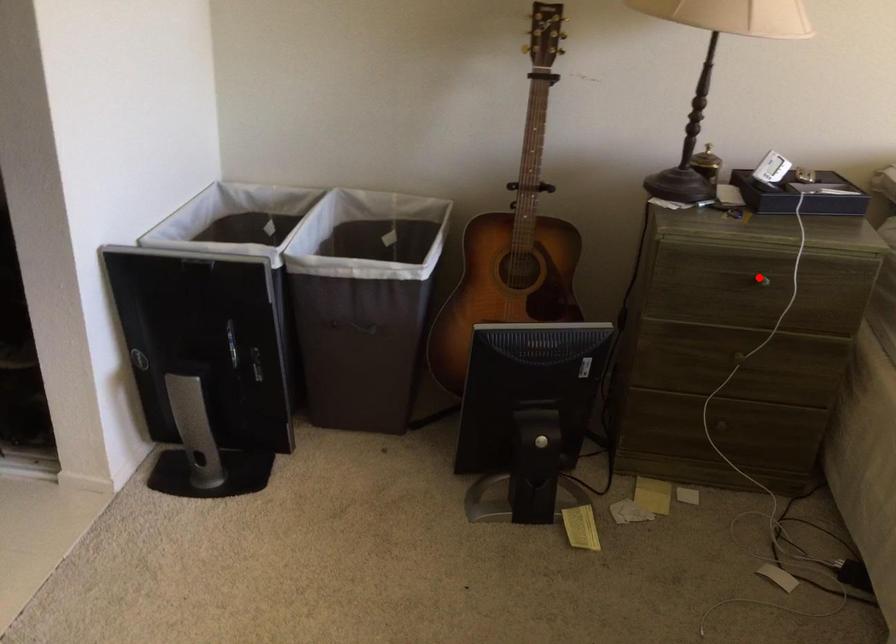
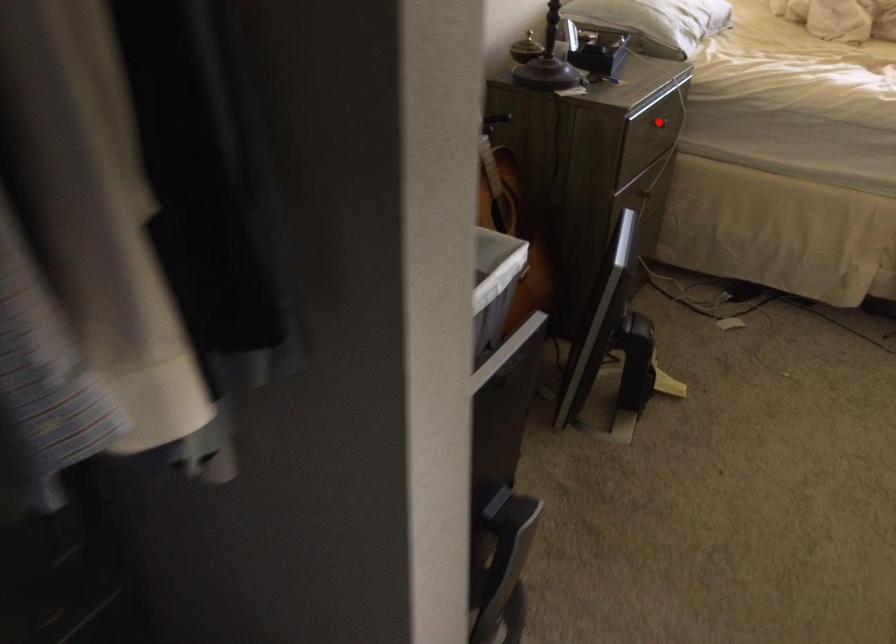
I am providing you with two images of the same scene from different viewpoints. A red point is marked on the first image and another point is marked on the second image. Do the highlighted points in image1 and image2 indicate the same real-world spot?

Yes